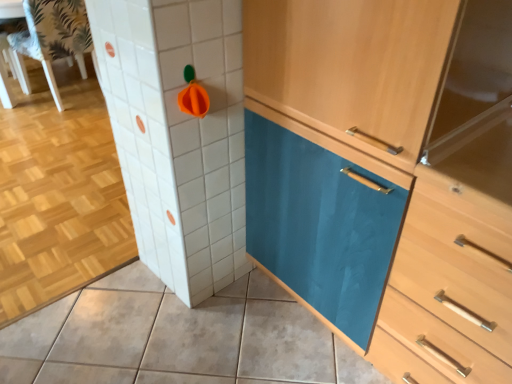
Question: Considering the relative positions of matte ceramic tile at lower center and teal glossy cabinet at center in the image provided, is matte ceramic tile at lower center to the right of teal glossy cabinet at center from the viewer's perspective?

Choices:
 (A) yes
 (B) no

Answer: (B)

Question: Is matte ceramic tile at lower center shorter than teal glossy cabinet at center?

Choices:
 (A) no
 (B) yes

Answer: (B)

Question: Is matte ceramic tile at lower center facing towards teal glossy cabinet at center?

Choices:
 (A) yes
 (B) no

Answer: (B)

Question: Is matte ceramic tile at lower center not within teal glossy cabinet at center?

Choices:
 (A) yes
 (B) no

Answer: (A)

Question: Does matte ceramic tile at lower center lie in front of teal glossy cabinet at center?

Choices:
 (A) no
 (B) yes

Answer: (A)

Question: Is light wood/wooden chest of drawers at center in front of or behind white fabric chair at upper left in the image?

Choices:
 (A) front
 (B) behind

Answer: (A)

Question: Is point pos(458,360) positioned closer to the camera than point pos(36,31)?

Choices:
 (A) closer
 (B) farther

Answer: (A)

Question: Is light wood/wooden chest of drawers at center to the left or to the right of white fabric chair at upper left in the image?

Choices:
 (A) right
 (B) left

Answer: (A)

Question: From a real-world perspective, is light wood/wooden chest of drawers at center physically located above or below white fabric chair at upper left?

Choices:
 (A) above
 (B) below

Answer: (A)

Question: Relative to white fabric chair at upper left, is matte ceramic tile at lower center in front or behind?

Choices:
 (A) front
 (B) behind

Answer: (A)

Question: From a real-world perspective, is matte ceramic tile at lower center above or below white fabric chair at upper left?

Choices:
 (A) above
 (B) below

Answer: (B)

Question: Based on their sizes in the image, would you say matte ceramic tile at lower center is bigger or smaller than white fabric chair at upper left?

Choices:
 (A) small
 (B) big

Answer: (A)

Question: In terms of height, does matte ceramic tile at lower center look taller or shorter compared to white fabric chair at upper left?

Choices:
 (A) short
 (B) tall

Answer: (A)

Question: Looking at their shapes, would you say light wood/wooden chest of drawers at center is wider or thinner than matte ceramic tile at lower center?

Choices:
 (A) wide
 (B) thin

Answer: (B)

Question: Is point (440, 231) positioned closer to the camera than point (112, 284)?

Choices:
 (A) closer
 (B) farther

Answer: (A)